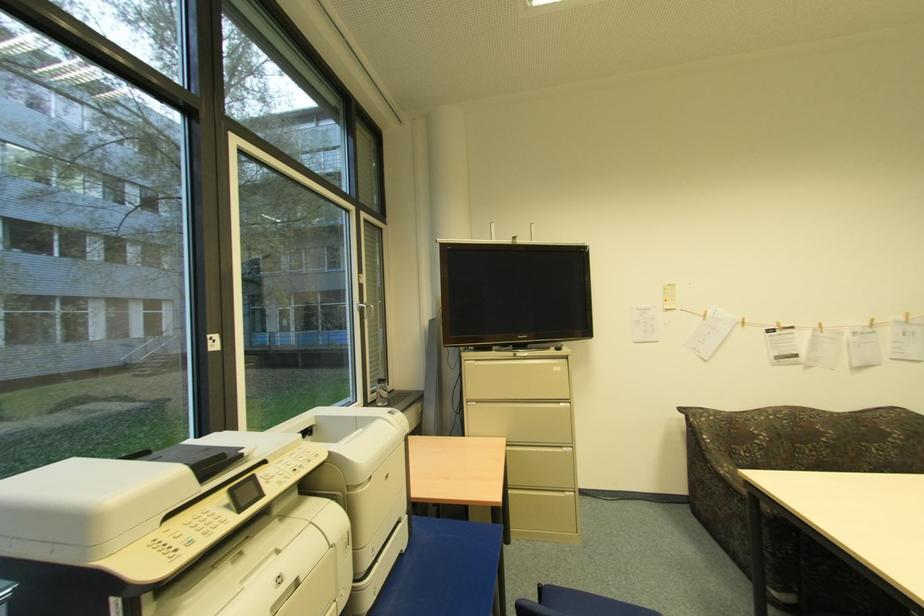
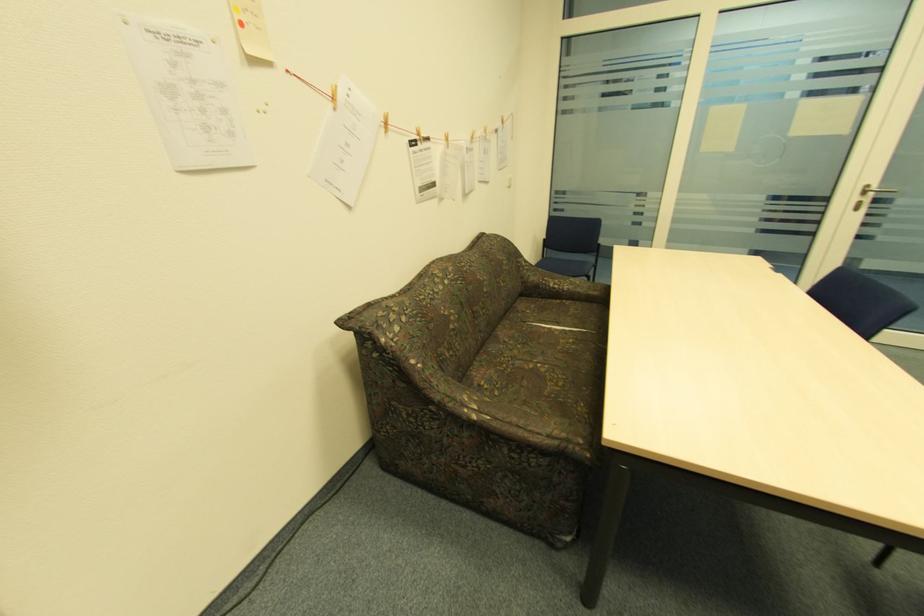
Locate, in the second image, the point that corresponds to point (723, 472) in the first image.

(477, 416)